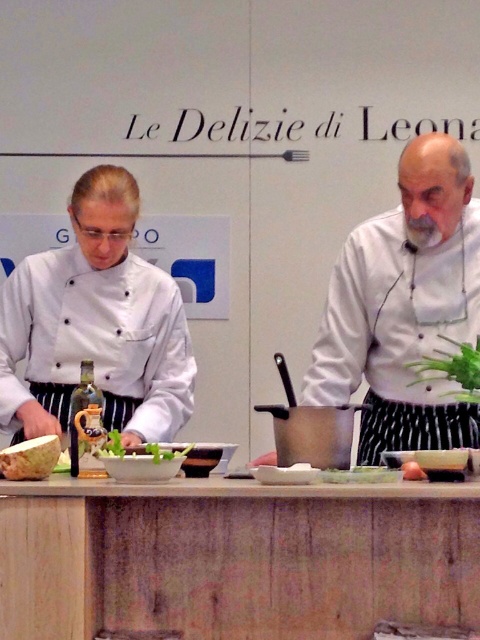
Is point (162, 312) behind point (16, 474)?

Yes, it is behind point (16, 474).

Locate an element on the screen. white matte chef coat at left is located at coordinates (96, 324).

Find the location of a particular element. The height and width of the screenshot is (640, 480). white matte chef coat at left is located at coordinates (96, 324).

Which of these two, white chef coat at center or white matte chef coat at left, stands taller?

white chef coat at center

Between white chef coat at center and white matte chef coat at left, which one has less height?

white matte chef coat at left

Locate an element on the screen. The width and height of the screenshot is (480, 640). white chef coat at center is located at coordinates (405, 307).

Does white chef coat at center appear over smooth white plate at center?

Correct, white chef coat at center is located above smooth white plate at center.

The image size is (480, 640). Find the location of `white chef coat at center`. white chef coat at center is located at coordinates (405, 307).